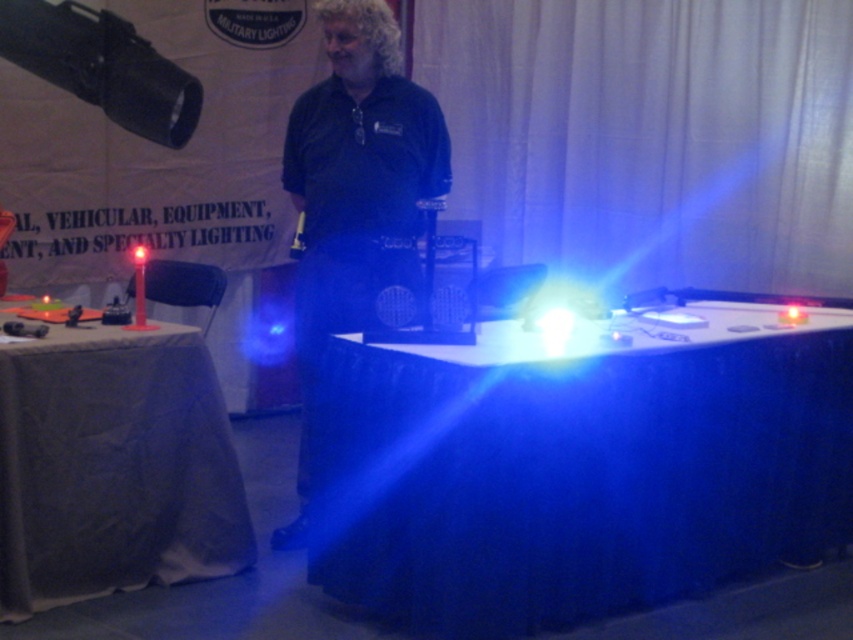
You are setting up for an event and need to place a 36 inch wide banner between the blue fabric table at center and the white cloth table at left. Can the banner fit between them without overlapping either table?

The blue fabric table at center is 37.15 inches away from the white cloth table at left. Since the banner is 36 inches wide, it can fit between them as the distance between the tables is greater than the banner width.

You are an attendee at the trade show and want to take a photo of the dark blue shirt at center. However, the white cloth table at left is blocking your view. Can you move the table to the side to get a clear shot?

The white cloth table at left has a smaller size compared to dark blue shirt at center, so it can be moved to the side to allow a clear view of the dark blue shirt at center.

You are setting up for an event and need to place a large banner stand that requires a table wider than 1.5 meters. You have two tables available, the blue fabric table at center and the white cloth table at left. Which table should you choose based on their widths?

The blue fabric table at center has a larger width than the white cloth table at left, so you should choose the blue fabric table at center for the banner stand.